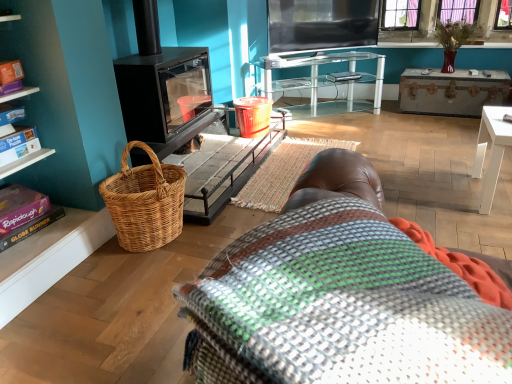
Find the location of `vacant space that is to the left of white glossy table at lower right, the 1th table viewed from the front`. vacant space that is to the left of white glossy table at lower right, the 1th table viewed from the front is located at coordinates (443, 197).